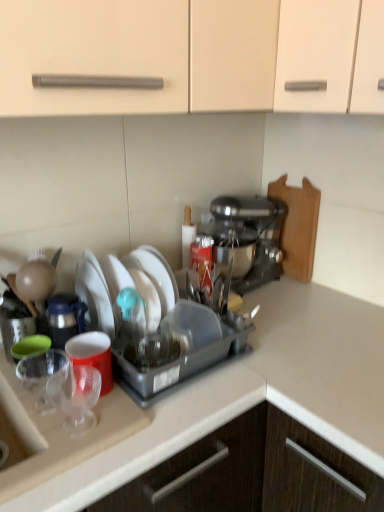
I want to click on vacant space positioned to the left of transparent plastic cup at lower left, placed as the 2th tableware when sorted from top to bottom, so click(36, 412).